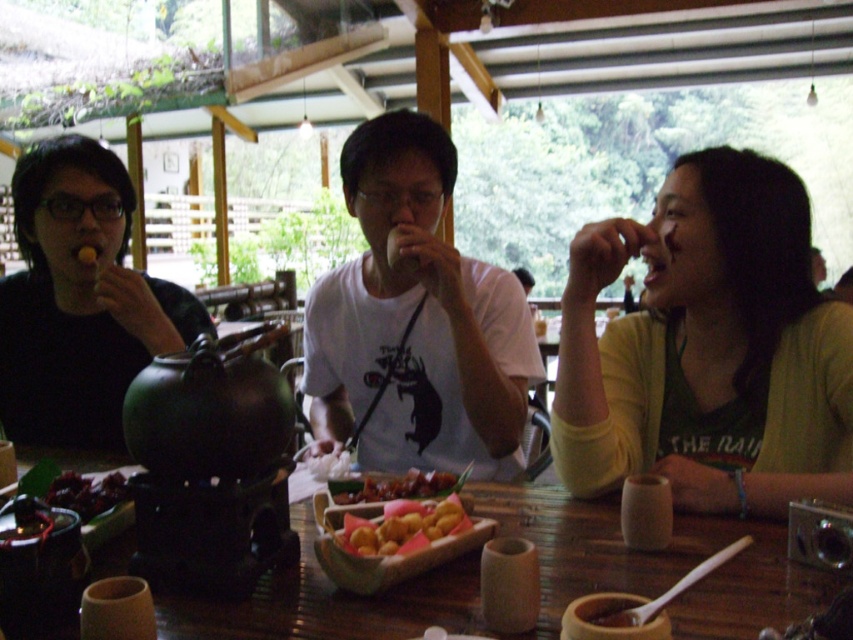
You are a server at the restaurant and need to place a 30 inch long tray between the golden crispy balls at center and the wooden table. Will the tray fit without overlapping either object?

The golden crispy balls at center are 34.06 inches apart, so the 30 inch tray will fit between them since it is shorter than the distance between the golden crispy balls at center.

You are standing in the outdoor dining area and want to move from point A to point B. Point A is at coordinate point(379, 522) and point B is at coordinate point(444, 520). Which point is closer to you?

Point A at coordinate point(379, 522) is closer to you than point B at coordinate point(444, 520) because it is further to the viewer.